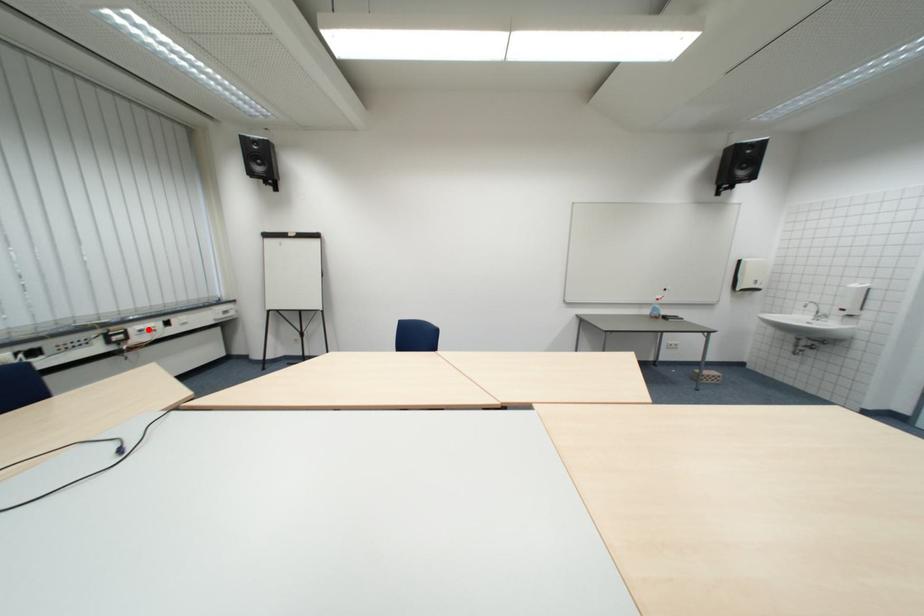
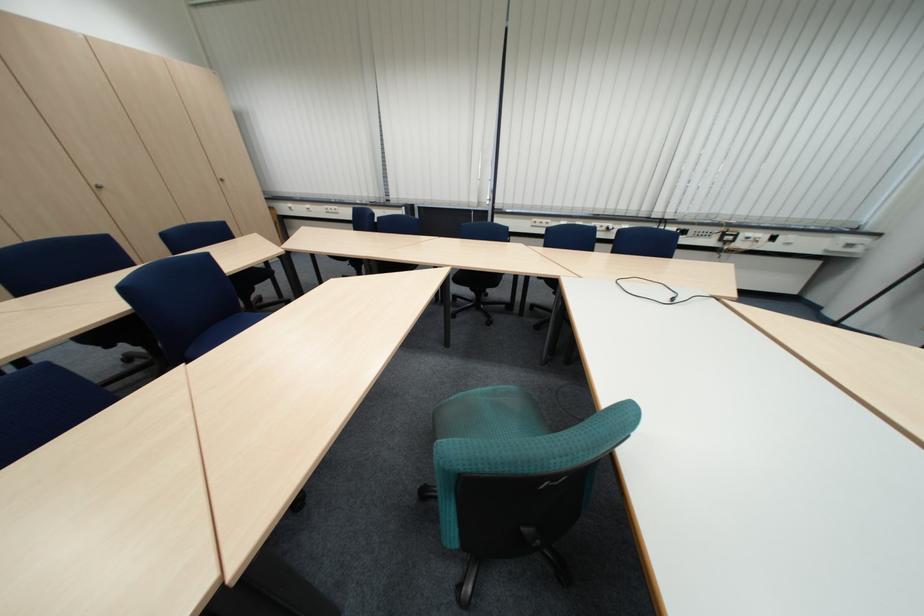
Question: I am providing you with two images of the same scene from different viewpoints. A red point is marked on the first image. At the location where the point appears in image 1, is it still visible in image 2?

Choices:
 (A) Yes
 (B) No

Answer: (A)